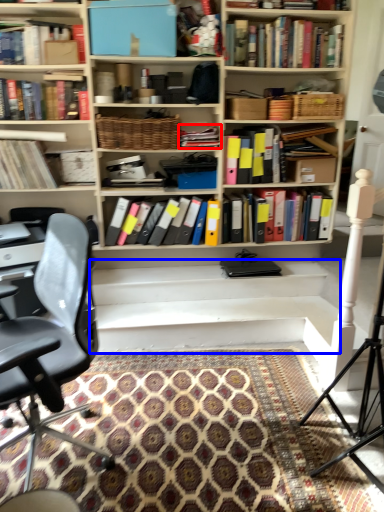
Question: Which object appears closest to the camera in this image, book (highlighted by a red box) or stairwell (highlighted by a blue box)?

Choices:
 (A) book
 (B) stairwell

Answer: (B)